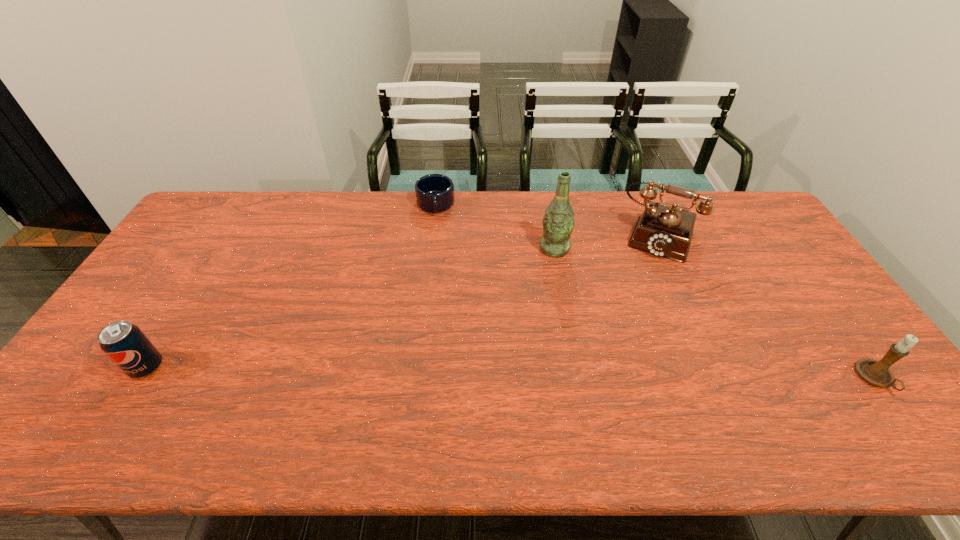
Locate an element on the screen. The width and height of the screenshot is (960, 540). vacant space on the desktop that is between the leftmost object and the candle holder and is positioned on the dial of the second object from right to left is located at coordinates (610, 374).

Locate an element on the screen. Image resolution: width=960 pixels, height=540 pixels. free space on the desktop that is between the soda can and the candle holder and is positioned on the surface of the third object from left to right is located at coordinates (522, 373).

At what (x,y) coordinates should I click in order to perform the action: click on vacant space on the desktop that is between the leftmost object and the candle holder and is positioned with the handle on the side of the second object from left to right. Please return your answer as a coordinate pair (x, y). This screenshot has width=960, height=540. Looking at the image, I should click on (443, 372).